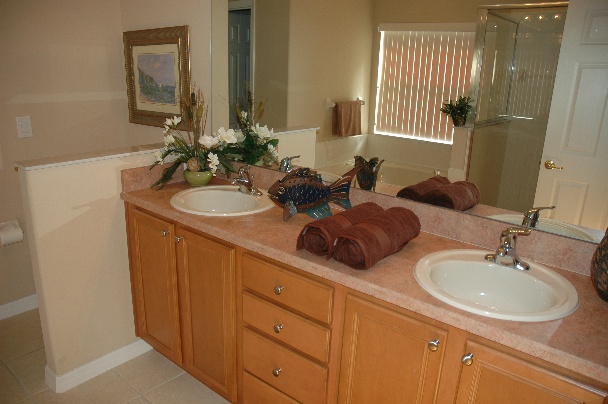
Locate an element on the screen. floor is located at coordinates (149, 373).